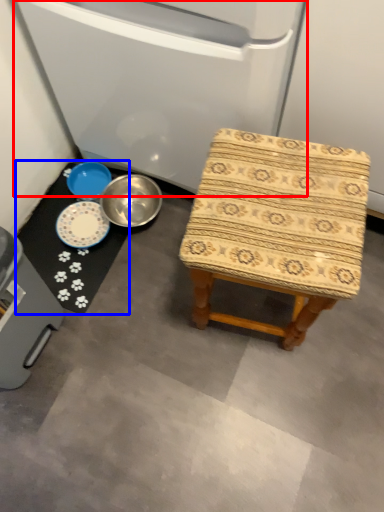
Question: Which object appears farthest to the camera in this image, appliance (highlighted by a red box) or mat (highlighted by a blue box)?

Choices:
 (A) appliance
 (B) mat

Answer: (B)